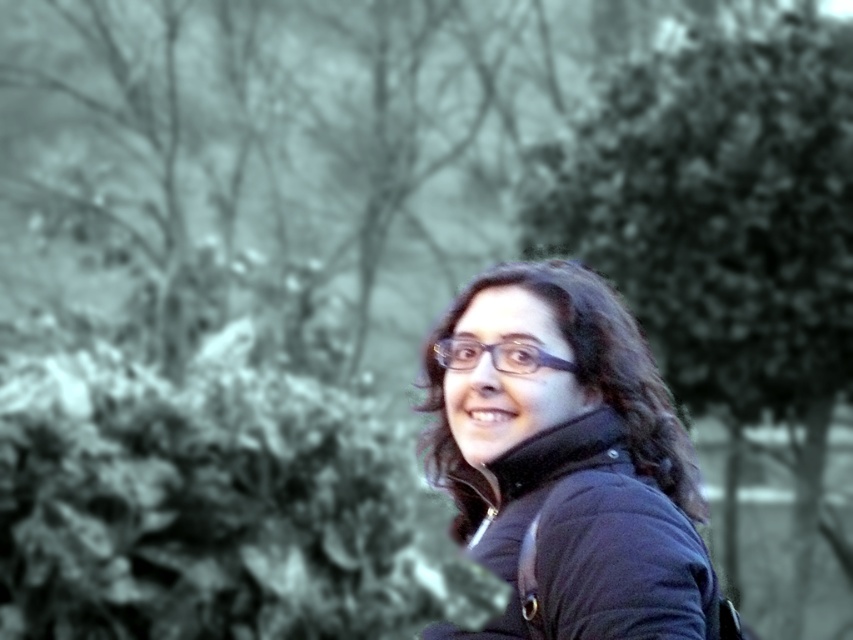
You are taking a photo and want to focus on the point at coordinate point (834, 76) and point (619, 330). Which point is closer to the camera?

Point (619, 330) is closer to the camera than point (834, 76).

You are a photographer adjusting the focus of your camera. You want to ensure that both the green leafy tree at right and the matte black jacket at center are clearly visible. Given their sizes, which object might require more careful adjustment to avoid blurring?

The matte black jacket at center requires more careful adjustment because it is smaller in size than the green leafy tree at right, making it potentially harder to focus on precisely.

You are a photographer trying to capture a portrait of the person wearing the matte black jacket at center. The green leafy tree at right is in the background. Since the tree is much taller than the jacket, how might this affect your composition?

The green leafy tree at right is much taller than the matte black jacket at center, so it could dominate the background and potentially overshadow the subject. To maintain focus on the jacket, consider adjusting the camera angle or using a shallower depth of field to blur the tree more effectively.